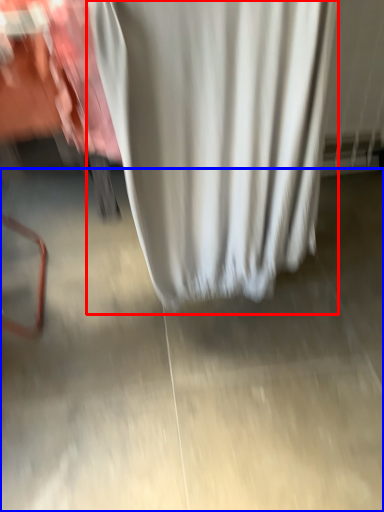
Question: Which object is further to the camera taking this photo, curtain (highlighted by a red box) or concrete (highlighted by a blue box)?

Choices:
 (A) curtain
 (B) concrete

Answer: (B)